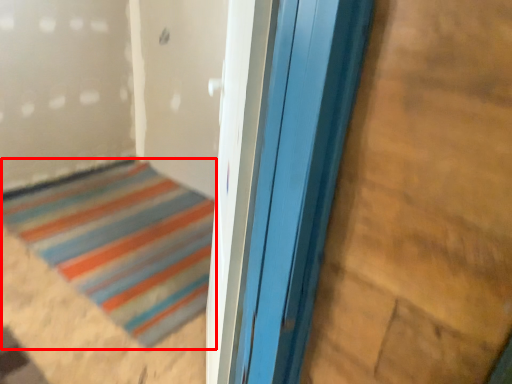
Question: From the image's perspective, what is the correct spatial positioning of door (annotated by the red box) in reference to plywood?

Choices:
 (A) above
 (B) below

Answer: (B)